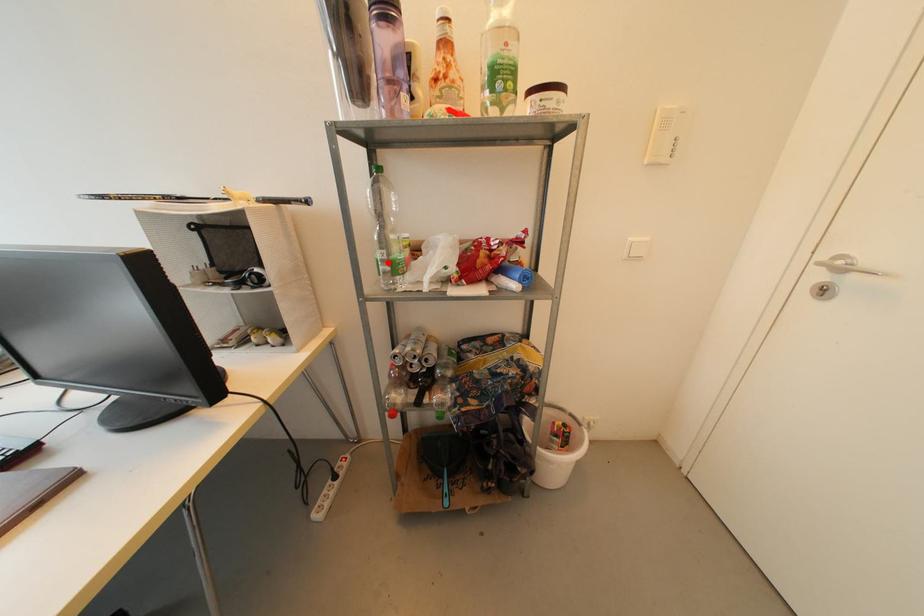
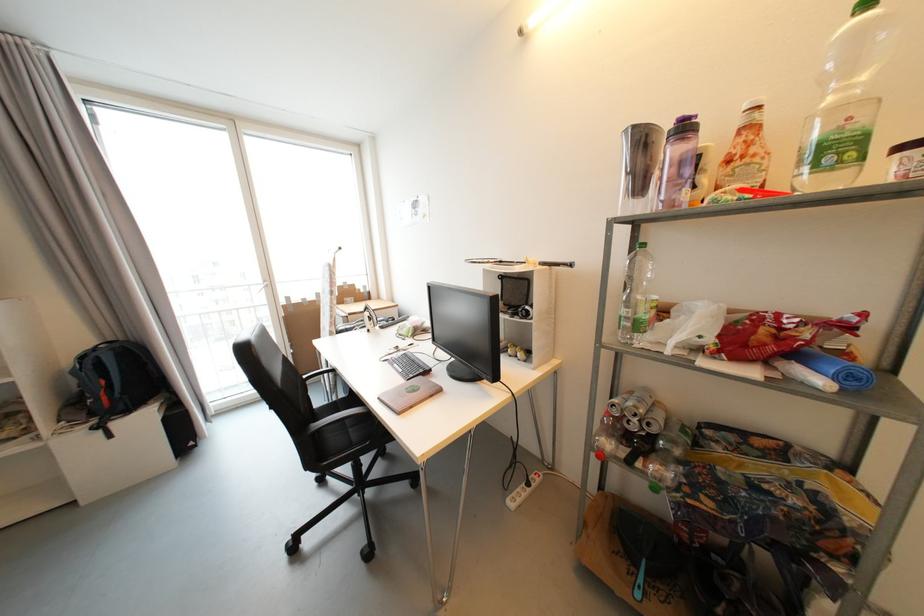
Find the pixel in the second image that matches the highlighted location in the first image.

(631, 320)